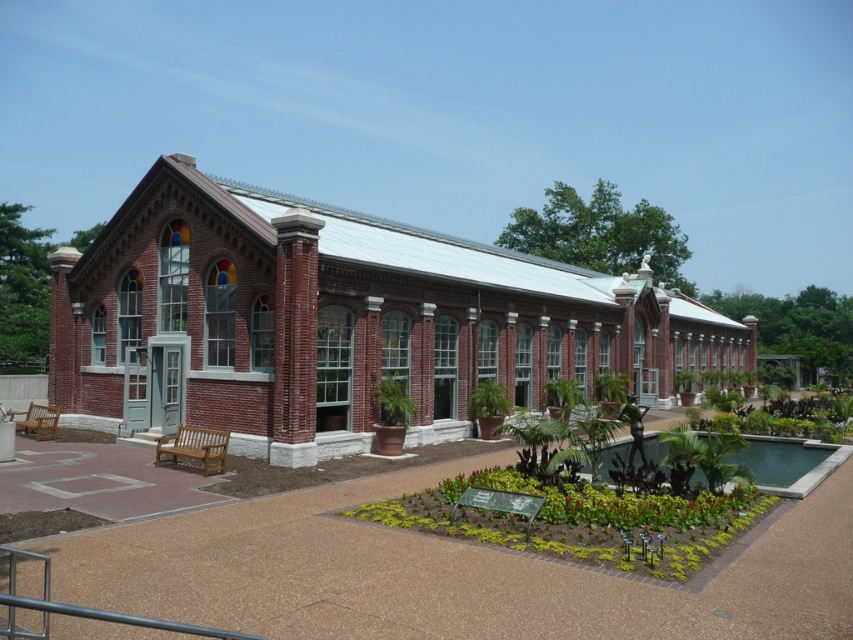
Question: Is red brick chapel at center smaller than lush greenery at center?

Choices:
 (A) no
 (B) yes

Answer: (A)

Question: Is lush greenery at center wider than green concrete pool at center?

Choices:
 (A) no
 (B) yes

Answer: (A)

Question: Is red brick chapel at center to the right of green concrete pool at center from the viewer's perspective?

Choices:
 (A) no
 (B) yes

Answer: (A)

Question: Among these objects, which one is nearest to the camera?

Choices:
 (A) lush greenery at center
 (B) green concrete pool at center
 (C) red brick chapel at center

Answer: (A)

Question: Among these points, which one is farthest from the camera?

Choices:
 (A) (325, 237)
 (B) (604, 477)

Answer: (A)

Question: Which of the following is the farthest from the observer?

Choices:
 (A) green concrete pool at center
 (B) lush greenery at center

Answer: (A)